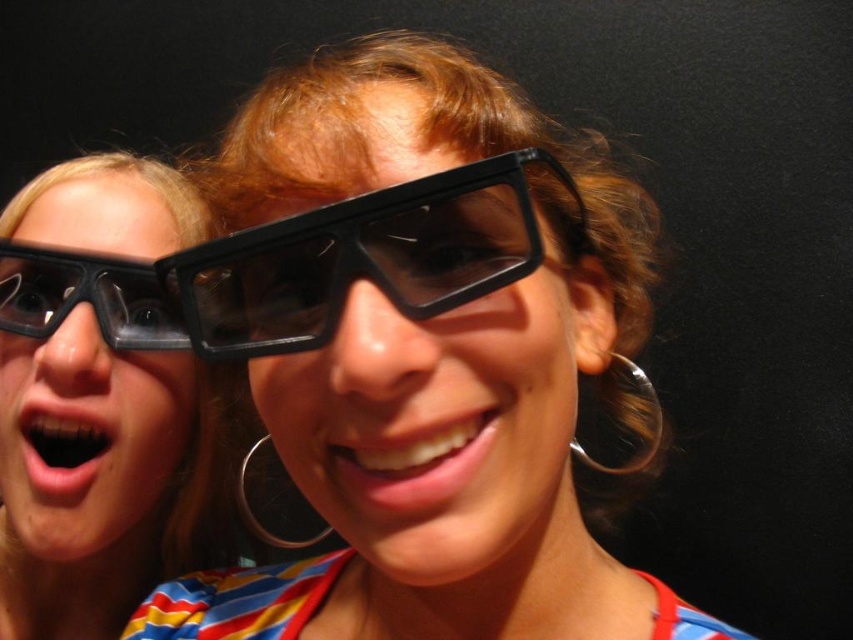
You are a photographer trying to capture a clear image of the matte black glasses at center and the black plastic glasses at center. Which one will be in focus if you focus on the person in the foreground?

The matte black glasses at center will be in focus because the black plastic glasses at center is behind it and further away from the photographer.

You are designing a storage box for the black plastic glasses at center and the black plastic goggles at center. Which one requires a narrower compartment due to their thickness?

The black plastic glasses at center requires a narrower compartment because it is thinner than the black plastic goggles at center.

You are a photographer trying to capture a group photo of two people wearing 3D glasses. The two people are positioned at point (383, 547). The minimum distance required for your camera to focus properly is 30 centimeters. Can you take the photo without moving them?

The two people positioned at point (383, 547) are 32.10 centimeters apart, which is greater than the minimum required 30 centimeters. Therefore, you can take the photo without moving them.